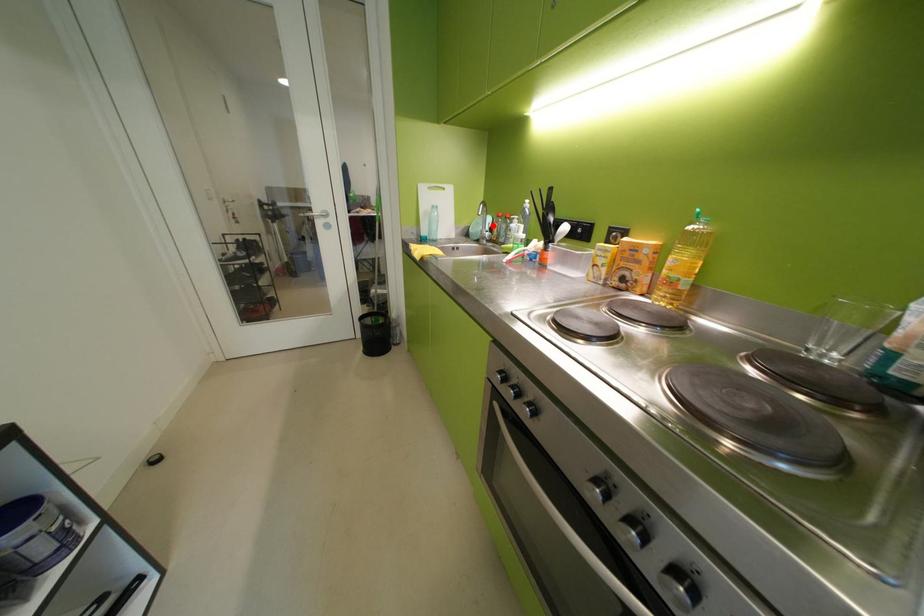
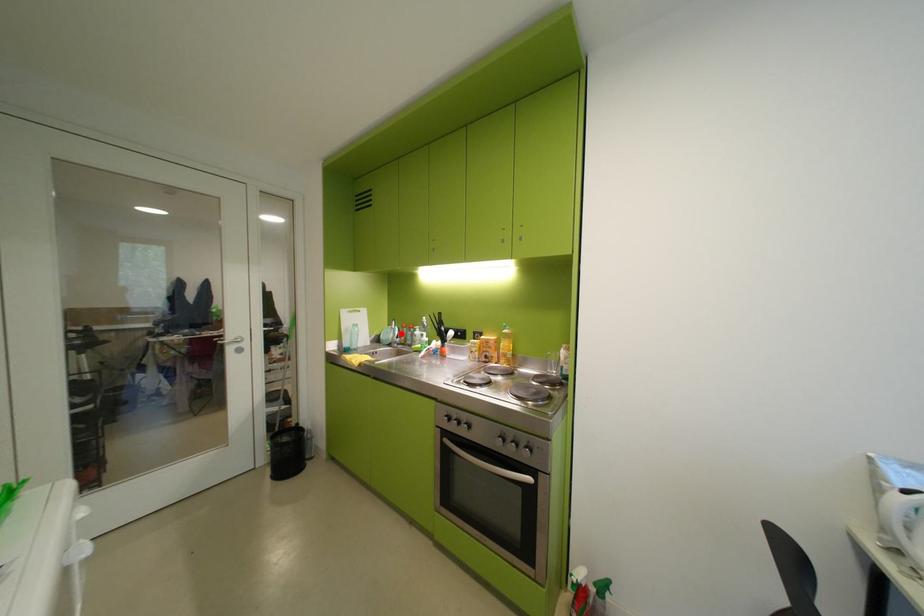
I am providing you with two images of the same scene from different viewpoints. A red point is marked on the first image and another point is marked on the second image. Is the red point in image1 aligned with the point shown in image2?

Yes